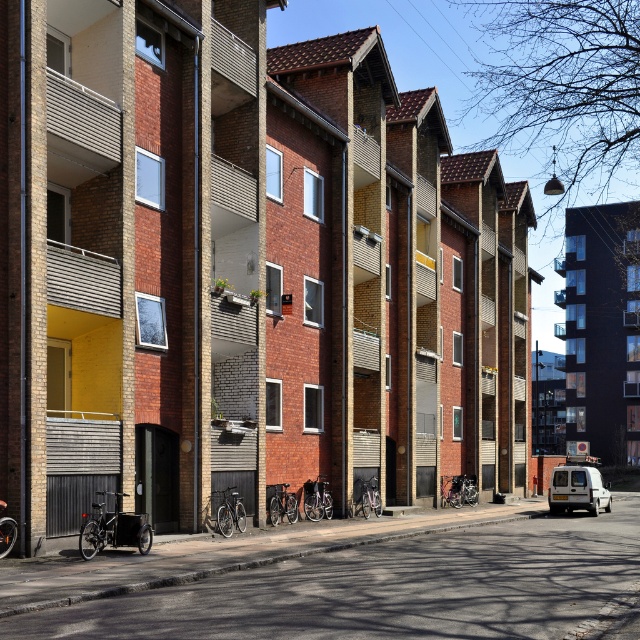
You are standing at the entrance of the residential buildings and want to park your bicycle. The entrance is located at the point with coordinates (x=396, y=589). Where should you place your bicycle?

The point (x=396, y=589) marks the location of black metal bicycles at lower left, so you should place your bicycle there.

You are a delivery person trying to park your white matte van at lower right. There are black metal bicycles at lower left blocking the entrance. Can you drive through the space between them and the van?

The black metal bicycles at lower left are above the white matte van at lower right, meaning they are positioned higher up and not blocking the entrance. Therefore, you can drive through the space between them and the van without any obstruction.